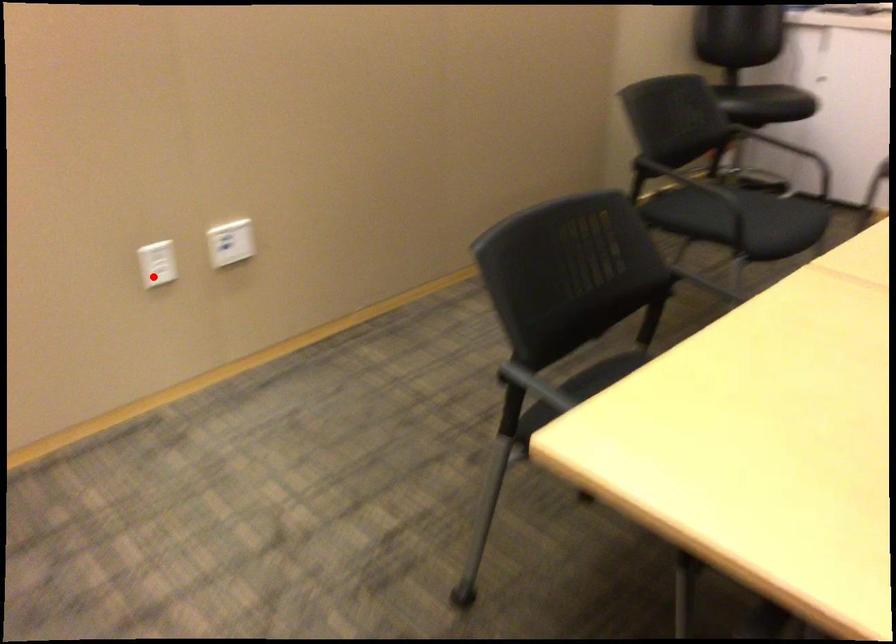
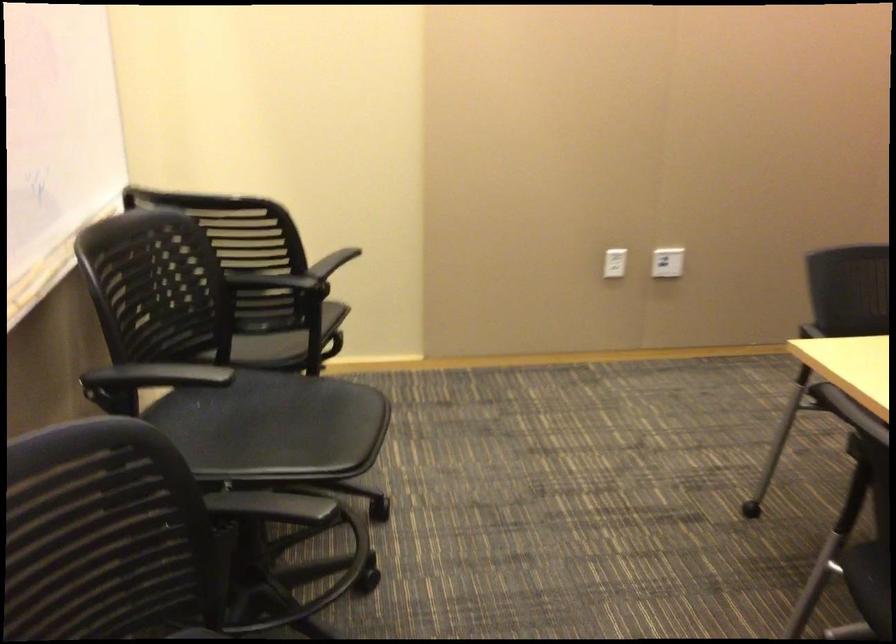
Locate, in the second image, the point that corresponds to the highlighted location in the first image.

(615, 263)